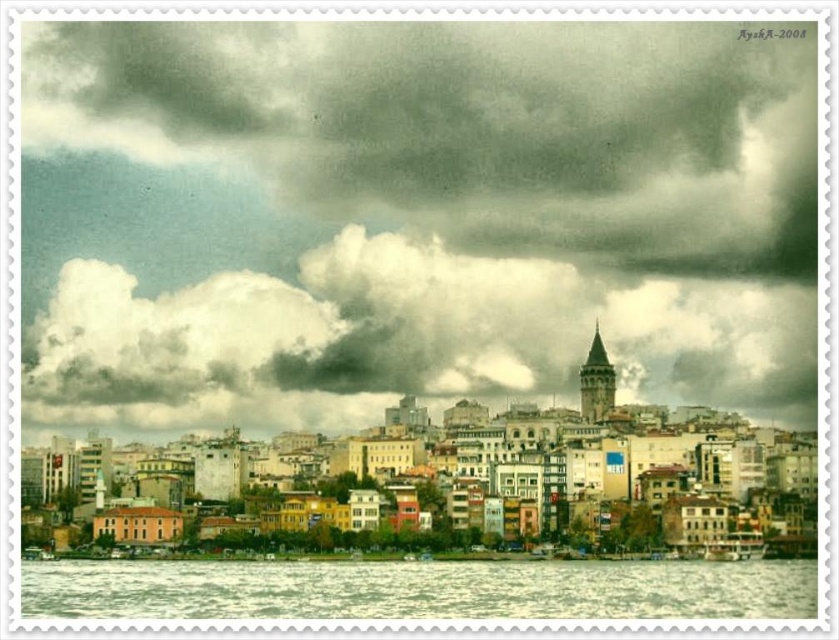
Who is shorter, cloudy sky at upper center or clear water at lower center?

clear water at lower center

Based on the photo, who is positioned more to the right, cloudy sky at upper center or clear water at lower center?

Positioned to the right is clear water at lower center.

Between point (789, 365) and point (21, 564), which one is positioned in front?

Point (21, 564) is in front.

At what (x,y) coordinates should I click in order to perform the action: click on cloudy sky at upper center. Please return your answer as a coordinate pair (x, y). Looking at the image, I should click on point(391,337).